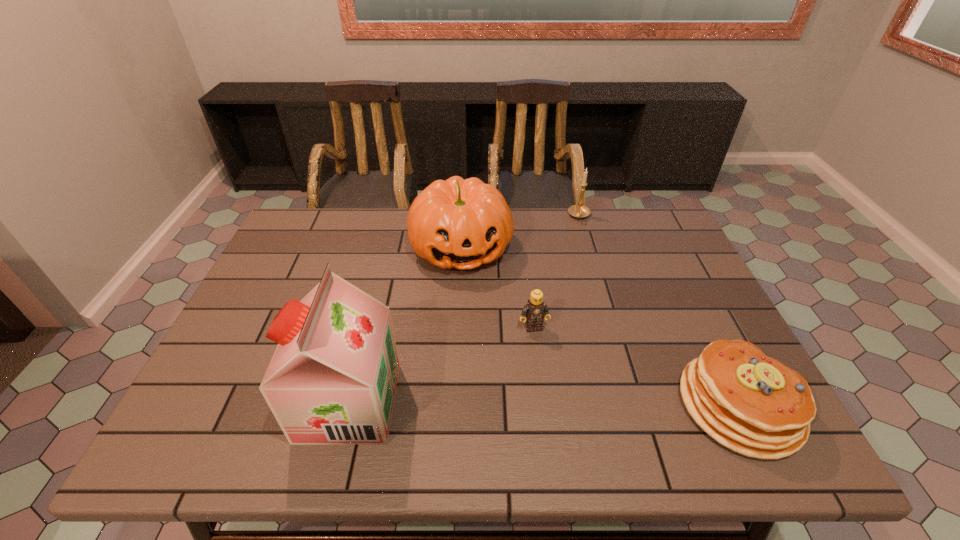
Image resolution: width=960 pixels, height=540 pixels. Find the location of `free space between the pumpkin and the third nearest object`. free space between the pumpkin and the third nearest object is located at coordinates (497, 287).

What are the coordinates of `vacant space in between the tallest object and the fourth object from left to right` in the screenshot? It's located at (464, 309).

The width and height of the screenshot is (960, 540). Identify the location of free space between the third farthest object and the rightmost object. (636, 366).

This screenshot has width=960, height=540. What are the coordinates of `free space between the tallest object and the fourth object from left to right` in the screenshot? It's located at (464, 309).

Locate an element on the screen. The height and width of the screenshot is (540, 960). free point between the third tallest object and the third nearest object is located at coordinates (557, 272).

At what (x,y) coordinates should I click in order to perform the action: click on vacant point located between the second tallest object and the soya milk. Please return your answer as a coordinate pair (x, y). This screenshot has height=540, width=960. Looking at the image, I should click on (405, 325).

The width and height of the screenshot is (960, 540). I want to click on vacant space in between the third farthest object and the second tallest object, so (x=497, y=287).

Find the location of a particular element. This screenshot has height=540, width=960. unoccupied position between the pumpkin and the rightmost object is located at coordinates (600, 326).

Where is `free area in between the candle holder and the fourth shortest object`? The image size is (960, 540). free area in between the candle holder and the fourth shortest object is located at coordinates (520, 232).

Locate an element on the screen. object that is the fourth closest to the rightmost object is located at coordinates (332, 380).